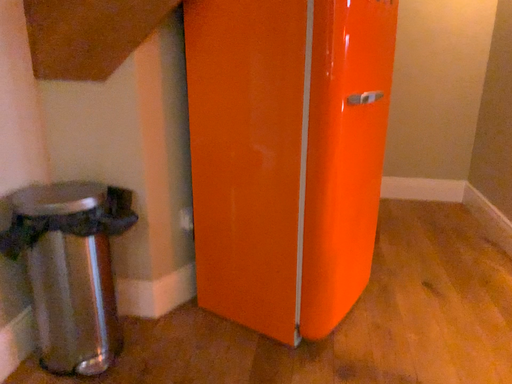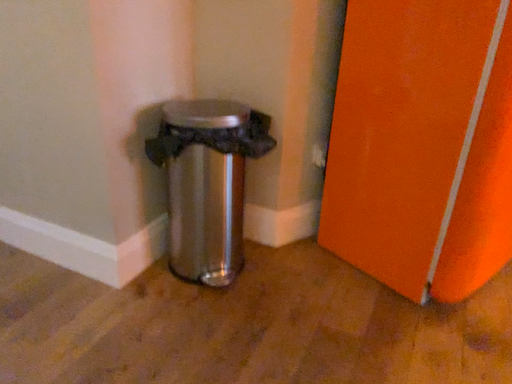
Question: How did the camera likely rotate when shooting the video?

Choices:
 (A) rotated left
 (B) rotated right

Answer: (A)